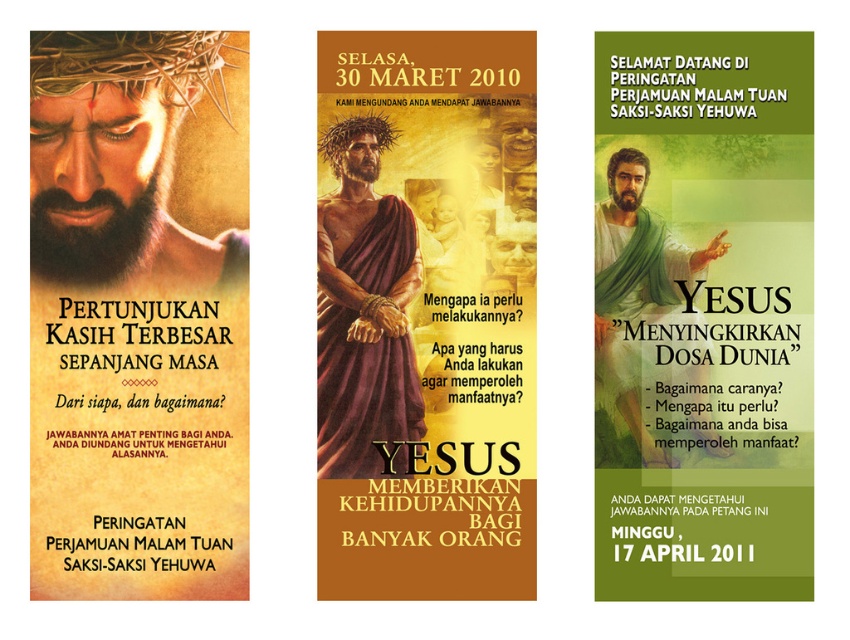
What is the location of the matte gold text at center on the left banner?

The matte gold text at center is located at point [426,314].

You are an art student analyzing the left banner. The banner has a matte gold text at center and a matte black face at upper left. Which element is visually more prominent in the banner?

The matte gold text at center is in front of the matte black face at upper left, making it more prominent.

You are an event planner reviewing the banners for a religious event. You notice the green matte banner at center and the matte gold crown of thorns at upper left. Which banner is positioned higher in the arrangement?

The matte gold crown of thorns at upper left is positioned higher than the green matte banner at center.